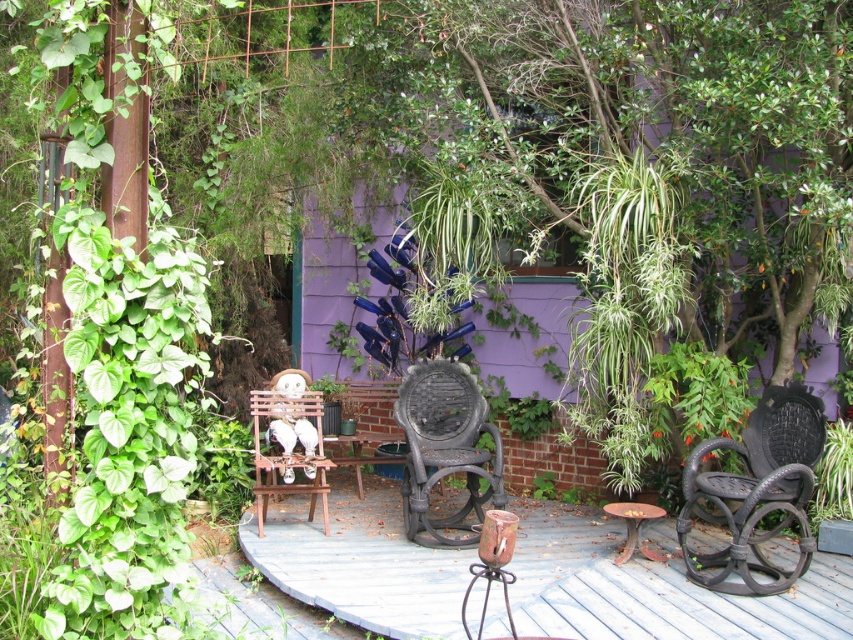
You are standing at the edge of the patio and want to place a new potted plant exactly at the center of the rustic wood table at center. According to the coordinates provided, where should you position the plant?

The plant should be placed at the coordinates point (653,586), which is the exact center of the rustic wood table at center.